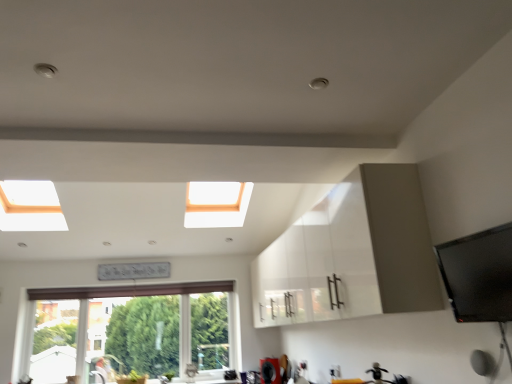
Question: Are white glossy cabinet at center and white frame window at lower left beside each other?

Choices:
 (A) no
 (B) yes

Answer: (A)

Question: Is white glossy cabinet at center looking in the opposite direction of white frame window at lower left?

Choices:
 (A) yes
 (B) no

Answer: (B)

Question: Is white glossy cabinet at center wider than white frame window at lower left?

Choices:
 (A) yes
 (B) no

Answer: (A)

Question: Is white glossy cabinet at center closer to the viewer compared to white frame window at lower left?

Choices:
 (A) no
 (B) yes

Answer: (B)

Question: Would you say white glossy cabinet at center is a long distance from white frame window at lower left?

Choices:
 (A) no
 (B) yes

Answer: (B)

Question: From the image's perspective, is white frame window at lower left above or below white glossy cabinet at center?

Choices:
 (A) above
 (B) below

Answer: (B)

Question: Considering the positions of white frame window at lower left and white glossy cabinet at center in the image, is white frame window at lower left bigger or smaller than white glossy cabinet at center?

Choices:
 (A) small
 (B) big

Answer: (A)

Question: From a real-world perspective, is white frame window at lower left above or below white glossy cabinet at center?

Choices:
 (A) above
 (B) below

Answer: (B)

Question: Is white frame window at lower left in front of or behind white glossy cabinet at center in the image?

Choices:
 (A) front
 (B) behind

Answer: (B)

Question: Does point (309, 291) appear closer or farther from the camera than point (92, 291)?

Choices:
 (A) farther
 (B) closer

Answer: (B)

Question: From the image's perspective, is white glossy cabinet at center located above or below white frame window at lower left?

Choices:
 (A) above
 (B) below

Answer: (A)

Question: From their relative heights in the image, would you say white glossy cabinet at center is taller or shorter than white frame window at lower left?

Choices:
 (A) short
 (B) tall

Answer: (A)

Question: Based on their positions, is white glossy cabinet at center located to the left or right of white frame window at lower left?

Choices:
 (A) right
 (B) left

Answer: (A)

Question: Looking at their shapes, would you say matte silver faucet at lower center is wider or thinner than white frame window at lower left?

Choices:
 (A) wide
 (B) thin

Answer: (A)

Question: Is matte silver faucet at lower center spatially inside white frame window at lower left, or outside of it?

Choices:
 (A) outside
 (B) inside

Answer: (A)